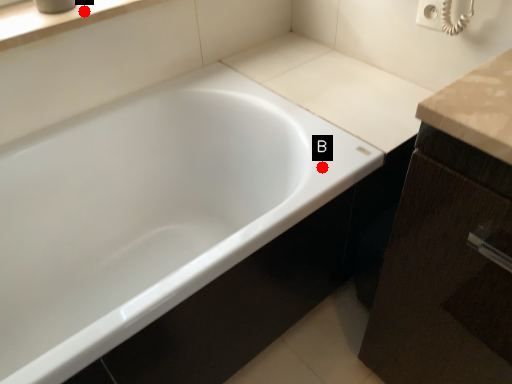
Question: Two points are circled on the image, labeled by A and B beside each circle. Which point is farther to the camera?

Choices:
 (A) A is further
 (B) B is further

Answer: (A)